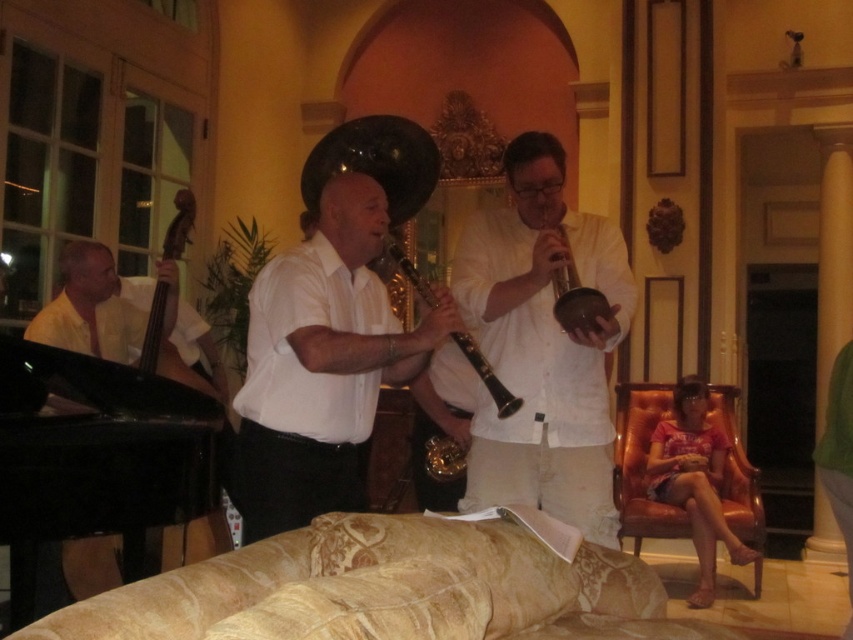
Question: Is black polished wood upright bass at left thinner than metallic gold trumpet at center?

Choices:
 (A) yes
 (B) no

Answer: (B)

Question: Which point is farther to the camera?

Choices:
 (A) white glossy clarinet at center
 (B) white linen shirt at center
 (C) metallic gold trumpet at center
 (D) black polished wood upright bass at left

Answer: (D)

Question: Among these objects, which one is nearest to the camera?

Choices:
 (A) metallic gold trumpet at center
 (B) gold-patterned fabric couch at lower center
 (C) black polished wood upright bass at left

Answer: (B)

Question: Is gold-patterned fabric couch at lower center bigger than matte black hautboy at lower right?

Choices:
 (A) yes
 (B) no

Answer: (B)

Question: Can you confirm if white glossy clarinet at center is thinner than metallic gold trumpet at center?

Choices:
 (A) no
 (B) yes

Answer: (A)

Question: Which point is closer to the camera?

Choices:
 (A) black matte clarinet at center
 (B) white linen shirt at center
 (C) white glossy clarinet at center
 (D) metallic gold trumpet at center

Answer: (C)